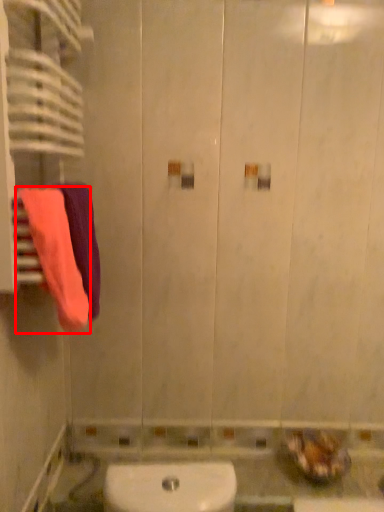
Question: From the image's perspective, what is the correct spatial positioning of towel (annotated by the red box) in reference to towel?

Choices:
 (A) above
 (B) below

Answer: (B)